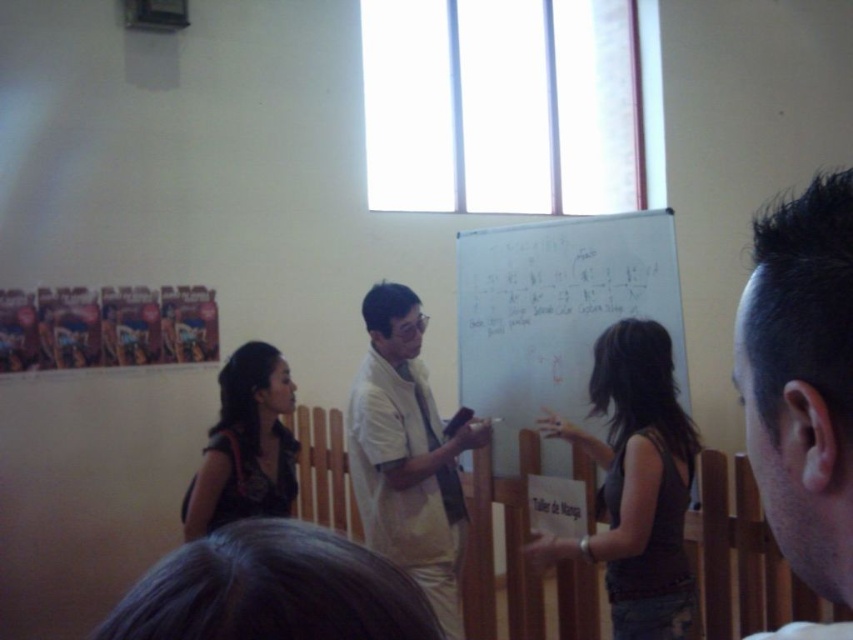
Who is taller, dark brown tank top at center or dark brown leather jacket at lower left?

Standing taller between the two is dark brown tank top at center.

Between point (573, 548) and point (277, 381), which one is positioned in front?

Positioned in front is point (573, 548).

Between point (607, 560) and point (270, 472), which one is positioned in front?

Positioned in front is point (607, 560).

Find the location of a particular element. The width and height of the screenshot is (853, 640). dark brown tank top at center is located at coordinates (636, 484).

Is dark brown tank top at center to the right of white matte shirt at center from the viewer's perspective?

Yes, dark brown tank top at center is to the right of white matte shirt at center.

Consider the image. Can you confirm if dark brown tank top at center is wider than white matte shirt at center?

In fact, dark brown tank top at center might be narrower than white matte shirt at center.

Is point (624, 612) closer to viewer compared to point (405, 563)?

Yes, it is.

You are a GUI agent. You are given a task and a screenshot of the screen. Output one action in this format:
    pyautogui.click(x=<x>, y=<y>)
    Task: Click on the dark brown tank top at center
    This screenshot has height=640, width=853.
    Given the screenshot: What is the action you would take?
    pos(636,484)

Is dark brown hair at upper right behind whiteboard at center?

No, it is in front of whiteboard at center.

Is point (769, 392) more distant than point (584, 264)?

No, it is not.

This screenshot has height=640, width=853. In order to click on dark brown hair at upper right in this screenshot , I will do `click(802, 380)`.